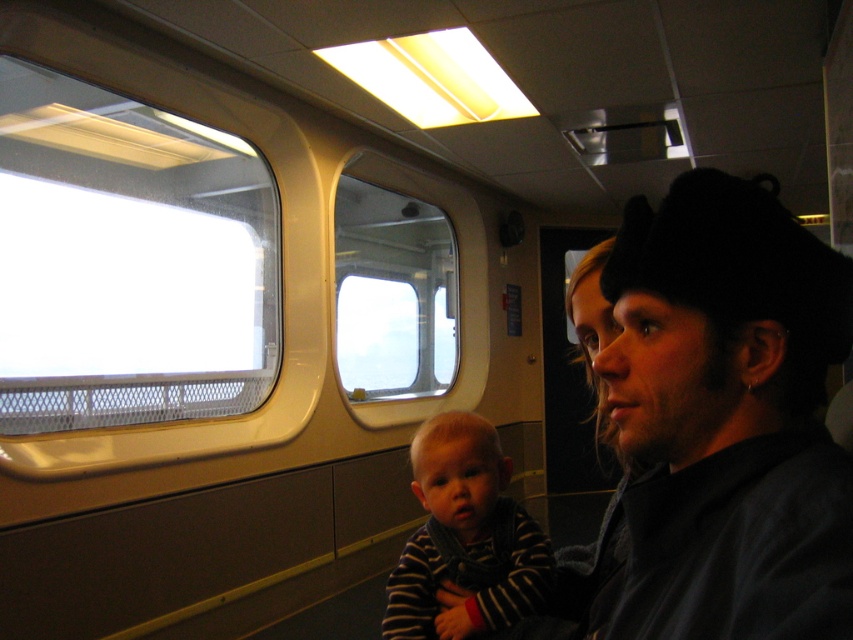
Is black knit cap at upper right above striped fabric baby at center?

Yes, black knit cap at upper right is above striped fabric baby at center.

Is point (654, 580) behind point (421, 554)?

No.

Describe the element at coordinates (726, 419) in the screenshot. I see `black knit cap at upper right` at that location.

Identify the location of black knit cap at upper right. (726, 419).

Is transparent glass window at upper left shorter than clear glass window at center?

Indeed, transparent glass window at upper left has a lesser height compared to clear glass window at center.

Which is more to the left, transparent glass window at upper left or clear glass window at center?

Positioned to the left is transparent glass window at upper left.

You are a GUI agent. You are given a task and a screenshot of the screen. Output one action in this format:
    pyautogui.click(x=<x>, y=<y>)
    Task: Click on the transparent glass window at upper left
    The height and width of the screenshot is (640, 853).
    Given the screenshot: What is the action you would take?
    click(128, 260)

I want to click on black knit cap at upper right, so click(x=726, y=419).

From the picture: Does black knit cap at upper right have a lesser width compared to transparent glass window at upper left?

Yes.

The height and width of the screenshot is (640, 853). I want to click on black knit cap at upper right, so click(726, 419).